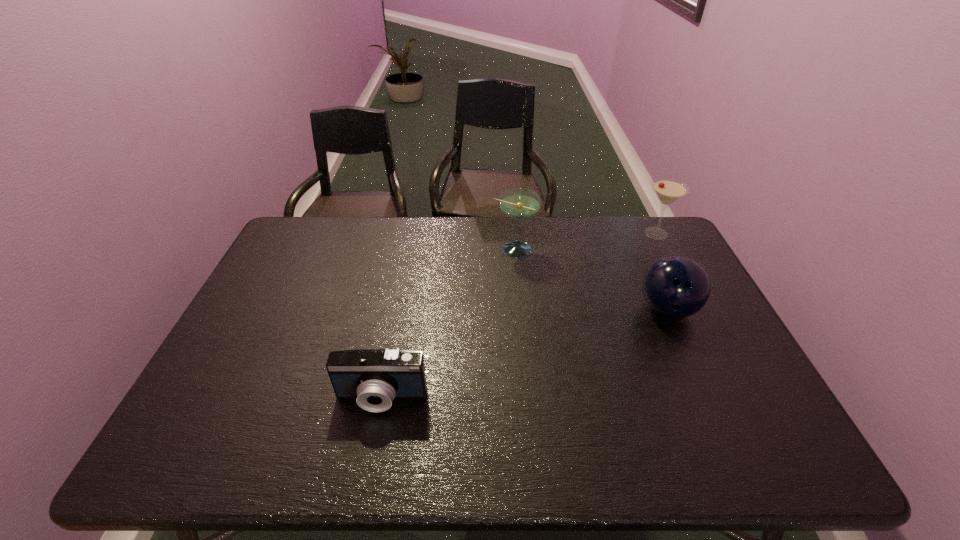
Where is `vacant area that lies between the third object from right to left and the camcorder`? This screenshot has height=540, width=960. vacant area that lies between the third object from right to left and the camcorder is located at coordinates (447, 323).

Where is `empty space between the second object from left to right and the shortest object`? The width and height of the screenshot is (960, 540). empty space between the second object from left to right and the shortest object is located at coordinates tap(447, 323).

At what (x,y) coordinates should I click in order to perform the action: click on free space between the bowling ball and the leftmost object. Please return your answer as a coordinate pair (x, y). This screenshot has height=540, width=960. Looking at the image, I should click on (524, 354).

Locate an element on the screen. Image resolution: width=960 pixels, height=540 pixels. object that ranks as the second closest to the third farthest object is located at coordinates (518, 203).

Locate which object is the closest to the bowling ball. Please provide its 2D coordinates. Your answer should be formatted as a tuple, i.e. [(x, y)], where the tuple contains the x and y coordinates of a point satisfying the conditions above.

[(668, 190)]

Image resolution: width=960 pixels, height=540 pixels. Find the location of `vacant space that satisfies the following two spatial constraints: 1. on the back side of the right martini; 2. on the left side of the left martini`. vacant space that satisfies the following two spatial constraints: 1. on the back side of the right martini; 2. on the left side of the left martini is located at coordinates (512, 233).

At what (x,y) coordinates should I click in order to perform the action: click on vacant area that satisfies the following two spatial constraints: 1. on the back side of the third object from right to left; 2. on the right side of the right martini. Please return your answer as a coordinate pair (x, y). The height and width of the screenshot is (540, 960). Looking at the image, I should click on (512, 233).